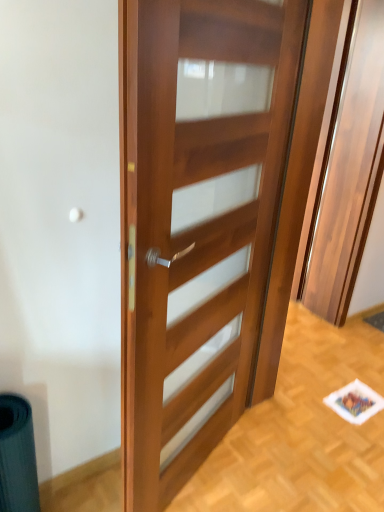
Question: Does wooden door at center have a greater width compared to wooden door at center?

Choices:
 (A) no
 (B) yes

Answer: (A)

Question: Does wooden door at center turn towards wooden door at center?

Choices:
 (A) yes
 (B) no

Answer: (B)

Question: Is wooden door at center completely or partially inside wooden door at center?

Choices:
 (A) no
 (B) yes

Answer: (A)

Question: Considering the relative sizes of wooden door at center and wooden door at center in the image provided, is wooden door at center smaller than wooden door at center?

Choices:
 (A) no
 (B) yes

Answer: (B)

Question: Is wooden door at center not close to wooden door at center?

Choices:
 (A) no
 (B) yes

Answer: (B)

Question: Does wooden door at center have a greater height compared to wooden door at center?

Choices:
 (A) yes
 (B) no

Answer: (B)

Question: Would you consider wooden door at center to be distant from wooden door at center?

Choices:
 (A) no
 (B) yes

Answer: (B)

Question: Are wooden door at center and wooden door at center making contact?

Choices:
 (A) no
 (B) yes

Answer: (A)

Question: Can you confirm if wooden door at center is thinner than wooden door at center?

Choices:
 (A) yes
 (B) no

Answer: (B)

Question: Is wooden door at center to the right of wooden door at center from the viewer's perspective?

Choices:
 (A) no
 (B) yes

Answer: (B)

Question: From the image's perspective, is wooden door at center located above wooden door at center?

Choices:
 (A) yes
 (B) no

Answer: (A)

Question: Could you tell me if wooden door at center is facing wooden door at center?

Choices:
 (A) no
 (B) yes

Answer: (A)

Question: From a real-world perspective, is wooden door at center physically located above or below wooden door at center?

Choices:
 (A) below
 (B) above

Answer: (B)